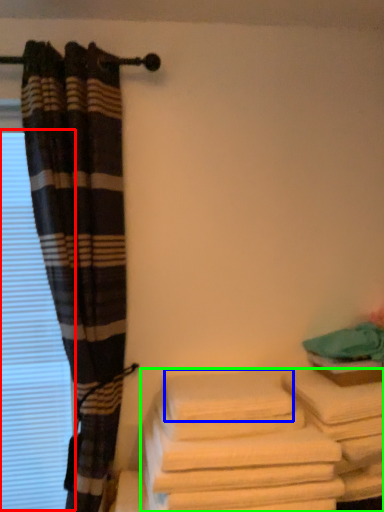
Question: Considering the real-world distances, which object is farthest from window (highlighted by a red box)? bath towel (highlighted by a blue box) or towel (highlighted by a green box)?

Choices:
 (A) bath towel
 (B) towel

Answer: (B)